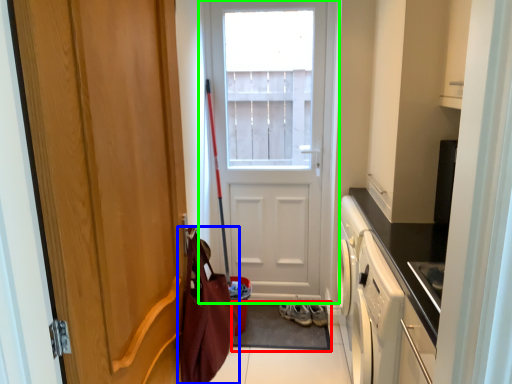
Question: Considering the real-world distances, which object is closest to doormat (highlighted by a red box)? messenger bag (highlighted by a blue box) or door (highlighted by a green box).

Choices:
 (A) messenger bag
 (B) door

Answer: (B)